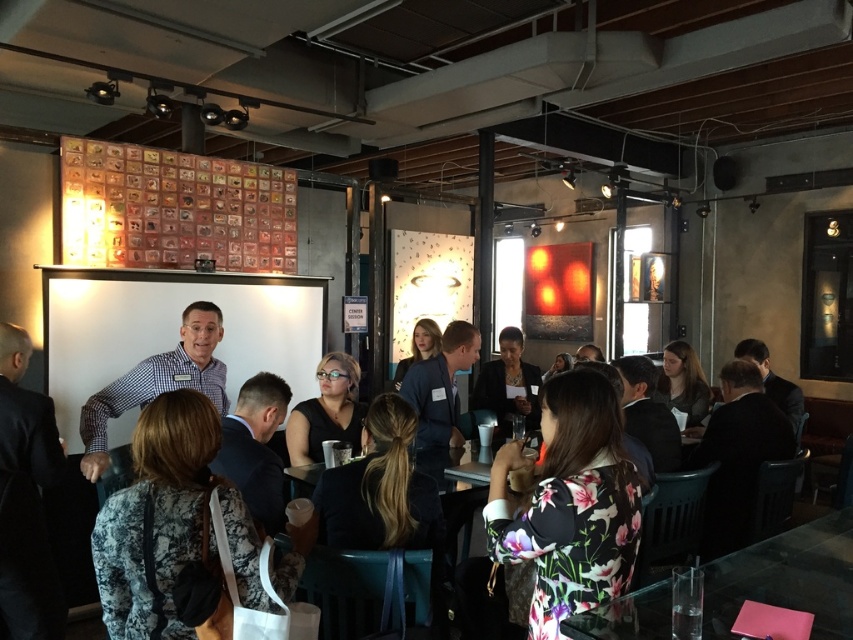
Question: Estimate the real-world distances between objects in this image. Which object is closer to the dark blue suit at center?

Choices:
 (A) dark gray blazer at center
 (B) matte black shirt at center
 (C) black suit at left
 (D) clear glass table at lower right

Answer: (B)

Question: Is the position of floral-patterned dress at center less distant than that of clear glass table at lower right?

Choices:
 (A) yes
 (B) no

Answer: (B)

Question: In this image, where is white glossy projection screen at center located relative to clear glass table at lower right?

Choices:
 (A) left
 (B) right

Answer: (A)

Question: Which of these objects is positioned closest to the dark blue suit at center?

Choices:
 (A) dark gray blazer at center
 (B) matte black shirt at center
 (C) black suit at left

Answer: (B)

Question: Can you confirm if dark blue suit at center is positioned to the left of matte gray sweater at center?

Choices:
 (A) no
 (B) yes

Answer: (B)

Question: Which point appears closest to the camera in this image?

Choices:
 (A) pos(242,492)
 (B) pos(402,362)
 (C) pos(82,369)
 (D) pos(252,561)

Answer: (D)